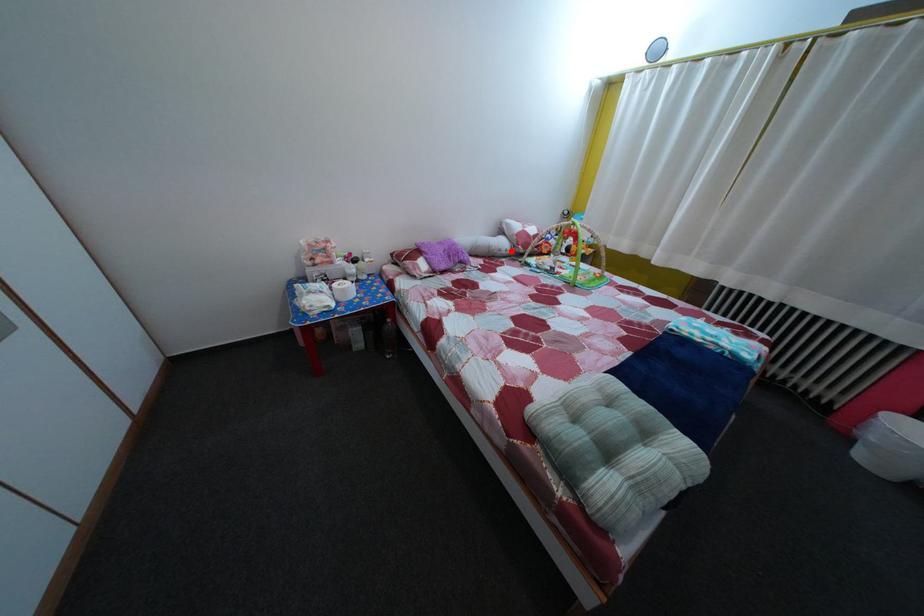
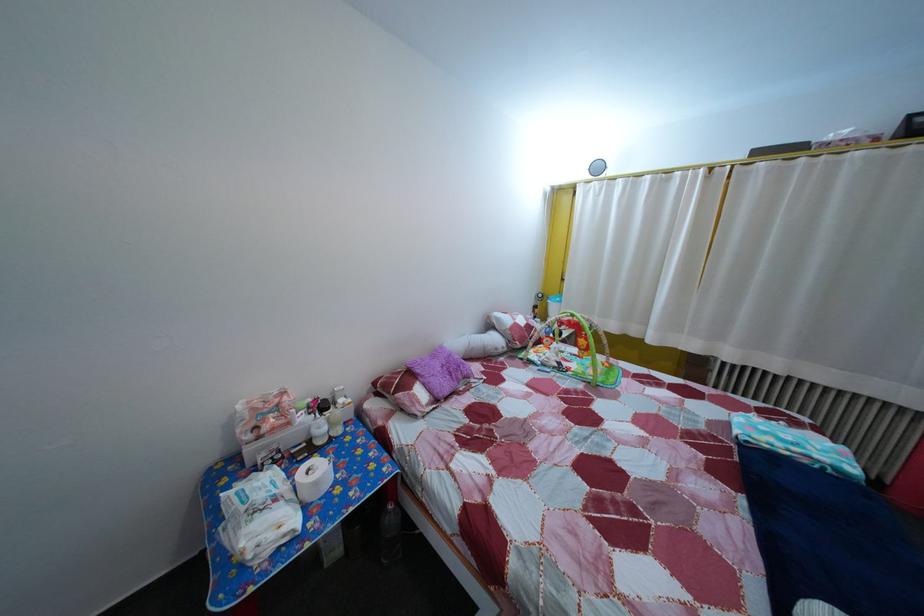
Question: I am providing you with two images of the same scene from different viewpoints. Image1 has a red point marked. In image2, the corresponding 3D location appears at what relative position? Reply with the corresponding letter.

Choices:
 (A) Closer
 (B) Farther

Answer: (B)